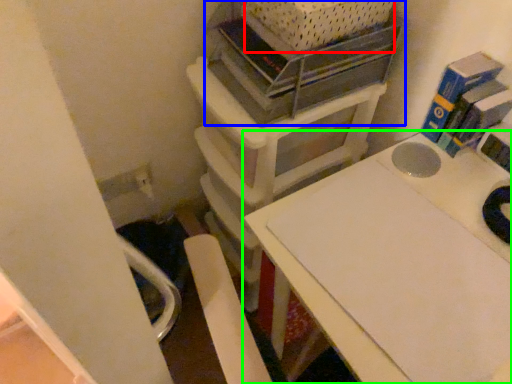
Question: Based on their relative distances, which object is nearer to crate (highlighted by a red box)? Choose from shelf (highlighted by a blue box) and table (highlighted by a green box).

Choices:
 (A) shelf
 (B) table

Answer: (A)